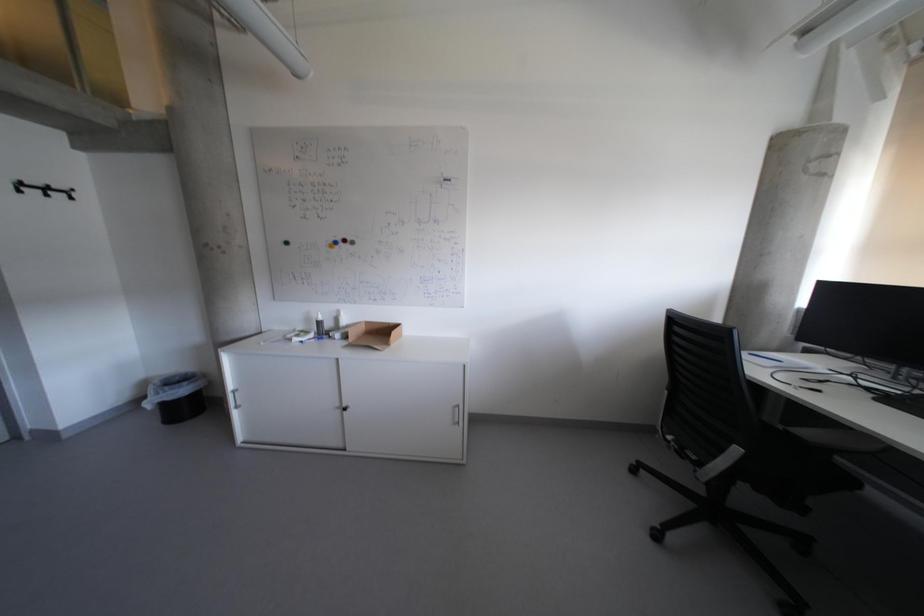
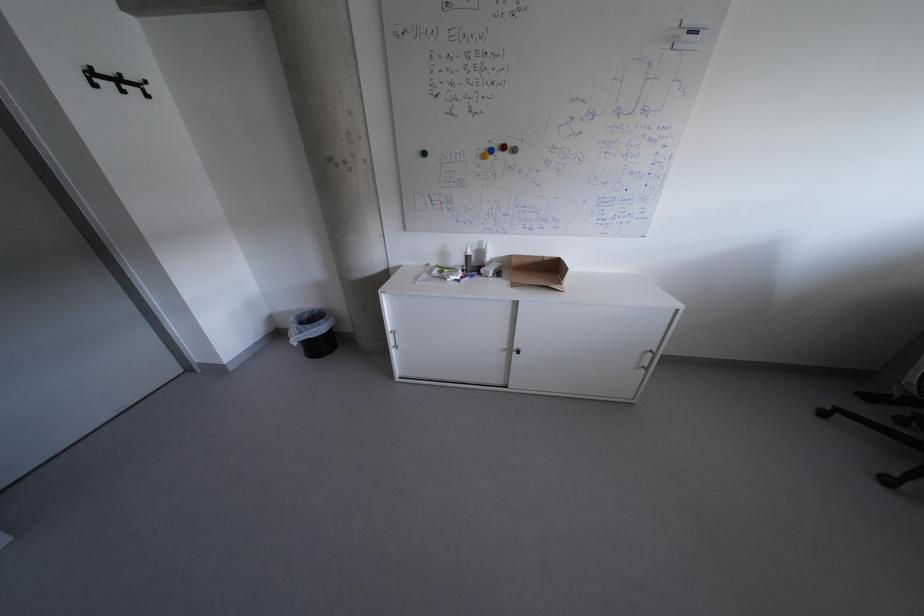
Question: In a continuous first-person perspective shot, in which direction is the camera moving?

Choices:
 (A) Left
 (B) Right
 (C) Forward
 (D) Backward

Answer: (A)